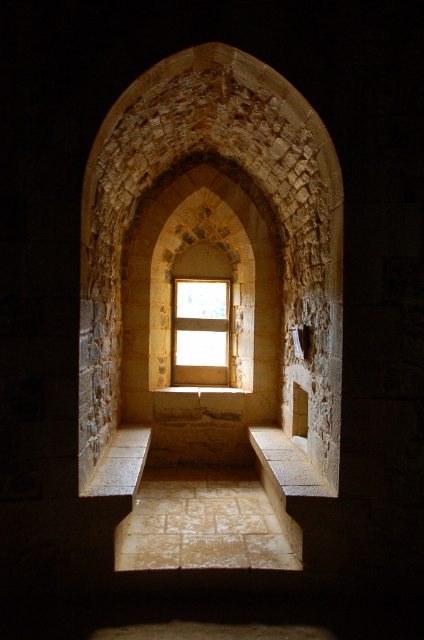
Question: Among these objects, which one is nearest to the camera?

Choices:
 (A) wooden frame window at center
 (B) stone textured archway at center

Answer: (B)

Question: Is stone textured archway at center to the right of wooden frame window at center from the viewer's perspective?

Choices:
 (A) no
 (B) yes

Answer: (B)

Question: Can you confirm if stone textured archway at center is positioned to the right of wooden frame window at center?

Choices:
 (A) no
 (B) yes

Answer: (B)

Question: Which point is farther to the camera?

Choices:
 (A) (178, 349)
 (B) (309, 161)

Answer: (A)

Question: Which of the following is the farthest from the observer?

Choices:
 (A) stone textured archway at center
 (B) wooden frame window at center

Answer: (B)

Question: Is stone textured archway at center smaller than wooden frame window at center?

Choices:
 (A) yes
 (B) no

Answer: (B)